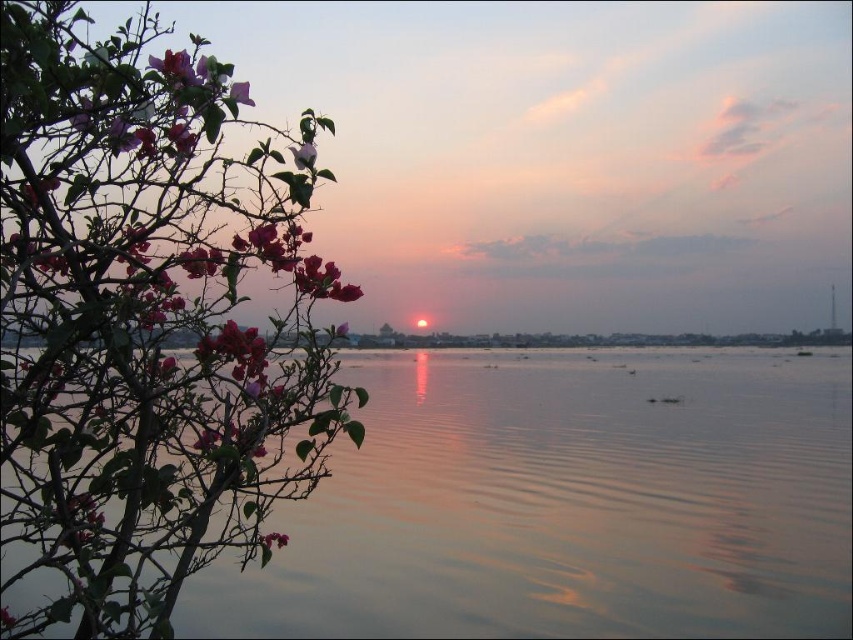
In the scene shown: Does purple matte flower at upper left appear on the right side of pink matte flower at left?

Indeed, purple matte flower at upper left is positioned on the right side of pink matte flower at left.

Which is behind, point (241, 90) or point (265, 541)?

The point (265, 541) is behind.

Who is more distant from viewer, (241, 81) or (286, 536)?

Positioned behind is point (286, 536).

This screenshot has width=853, height=640. What are the coordinates of `purple matte flower at upper left` in the screenshot? It's located at (241, 93).

Does pink matte leaves at left have a greater height compared to purple matte flower at upper left?

Yes.

Between point (111, 301) and point (245, 97), which one is positioned behind?

Positioned behind is point (245, 97).

What do you see at coordinates (143, 321) in the screenshot? The height and width of the screenshot is (640, 853). I see `pink matte leaves at left` at bounding box center [143, 321].

What are the coordinates of `pink matte leaves at left` in the screenshot? It's located at (143, 321).

Is pink matte leaves at left in front of pink matte flower at upper left?

That is True.

Who is higher up, pink matte leaves at left or pink matte flower at upper left?

Positioned higher is pink matte flower at upper left.

Which is behind, point (30, 627) or point (308, 161)?

Point (30, 627)

The width and height of the screenshot is (853, 640). Find the location of `pink matte leaves at left`. pink matte leaves at left is located at coordinates (143, 321).